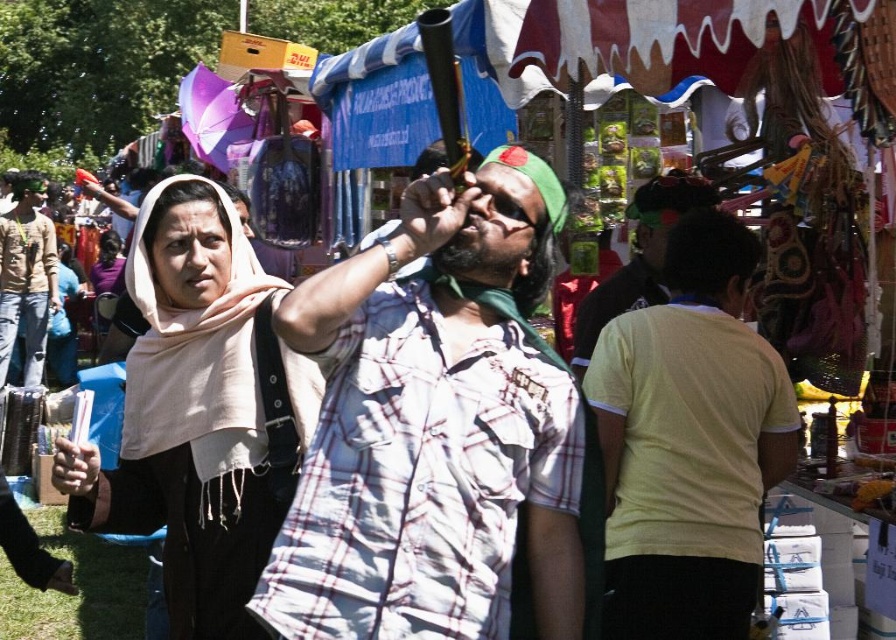
Question: Which object appears farthest from the camera in this image?

Choices:
 (A) beige fabric scarf at left
 (B) light brown cotton shirt at left
 (C) yellow cotton t-shirt at center
 (D) white checkered shirt at center

Answer: (B)

Question: Is beige fabric scarf at left positioned in front of yellow cotton t-shirt at center?

Choices:
 (A) yes
 (B) no

Answer: (A)

Question: Is white checkered shirt at center further to camera compared to beige fabric scarf at left?

Choices:
 (A) yes
 (B) no

Answer: (B)

Question: Which object is positioned closest to the beige fabric scarf at left?

Choices:
 (A) light brown cotton shirt at left
 (B) white checkered shirt at center
 (C) yellow cotton t-shirt at center

Answer: (B)

Question: Can you confirm if white checkered shirt at center is bigger than beige fabric scarf at left?

Choices:
 (A) no
 (B) yes

Answer: (A)

Question: Which point appears farthest from the camera in this image?

Choices:
 (A) (448, 273)
 (B) (274, 280)
 (C) (720, 292)

Answer: (C)